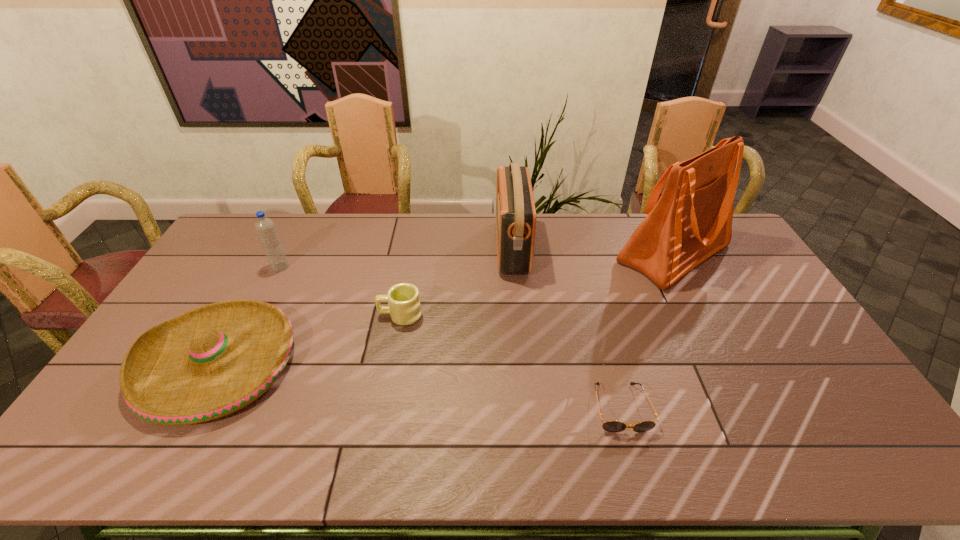
Find the location of `free location located on the front of the rightmost object`. free location located on the front of the rightmost object is located at coordinates (722, 348).

This screenshot has height=540, width=960. I want to click on vacant region located 0.380m on the front-facing side of the radio receiver, so click(x=393, y=247).

The height and width of the screenshot is (540, 960). Identify the location of vacant space located on the front-facing side of the radio receiver. (409, 247).

Locate an element on the screen. This screenshot has height=540, width=960. free space located on the front-facing side of the radio receiver is located at coordinates (452, 247).

The image size is (960, 540). Identify the location of free space located on the front of the third tallest object. (247, 332).

You are a GUI agent. You are given a task and a screenshot of the screen. Output one action in this format:
    pyautogui.click(x=<x>, y=<y>)
    Task: Click on the free space located 0.300m on the back of the sombrero
    
    Given the screenshot: What is the action you would take?
    pyautogui.click(x=279, y=249)

The height and width of the screenshot is (540, 960). Identify the location of blank space located with the handle on the side of the fifth tallest object. (336, 315).

Find the location of a particular element. The width and height of the screenshot is (960, 540). vacant space located 0.080m with the handle on the side of the fifth tallest object is located at coordinates (352, 315).

Locate an element on the screen. This screenshot has width=960, height=540. free space located 0.120m with the handle on the side of the fifth tallest object is located at coordinates (340, 315).

What are the coordinates of `shopping bag located at the far edge` in the screenshot? It's located at (692, 220).